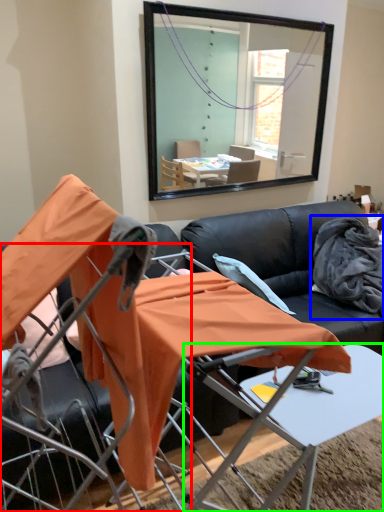
Question: Which object is the farthest from chair (highlighted by a red box)? Choose among these: fabric (highlighted by a blue box) or table (highlighted by a green box).

Choices:
 (A) fabric
 (B) table

Answer: (A)